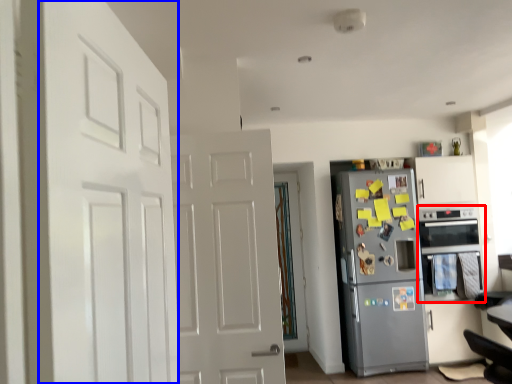
Question: Which of the following is the closest to the observer, oven (highlighted by a red box) or door (highlighted by a blue box)?

Choices:
 (A) oven
 (B) door

Answer: (B)